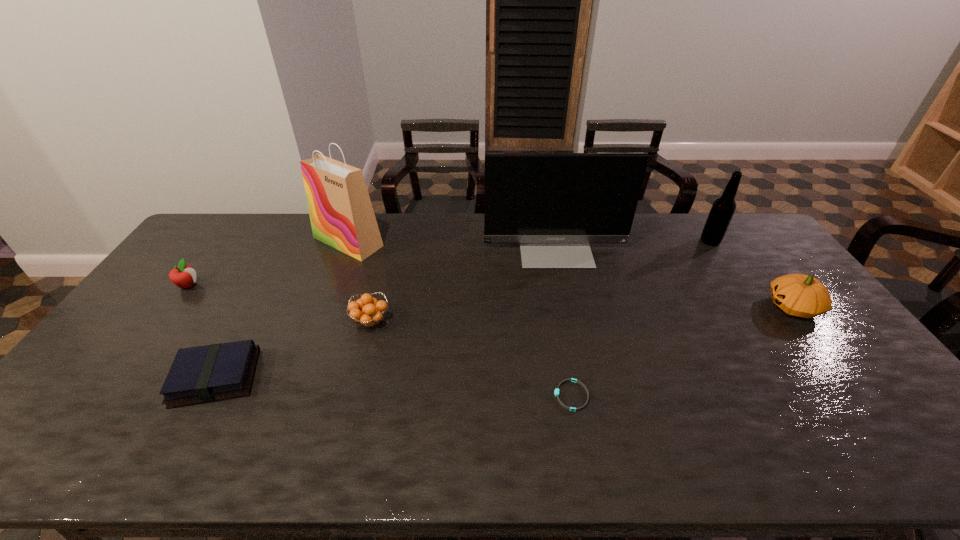
You are a GUI agent. You are given a task and a screenshot of the screen. Output one action in this format:
    pyautogui.click(x=<x>, y=<y>)
    Task: Click on the shopping bag
    
    Given the screenshot: What is the action you would take?
    pyautogui.click(x=341, y=214)

This screenshot has width=960, height=540. In order to click on computer monitor in this screenshot , I will do `click(554, 204)`.

What are the coordinates of `the sixth shortest object` in the screenshot? It's located at coord(721,213).

Locate an element on the screen. The height and width of the screenshot is (540, 960). beer bottle is located at coordinates (721, 213).

Locate an element on the screen. This screenshot has height=540, width=960. the rightmost object is located at coordinates (800, 295).

Where is `gourd`? gourd is located at coordinates (800, 295).

Locate an element on the screen. This screenshot has height=540, width=960. apple is located at coordinates (184, 276).

Identify the location of orange fruit. (372, 312).

Locate an element on the screen. The width and height of the screenshot is (960, 540). book is located at coordinates (203, 374).

What are the coordinates of `the shortest object` in the screenshot? It's located at click(x=556, y=392).